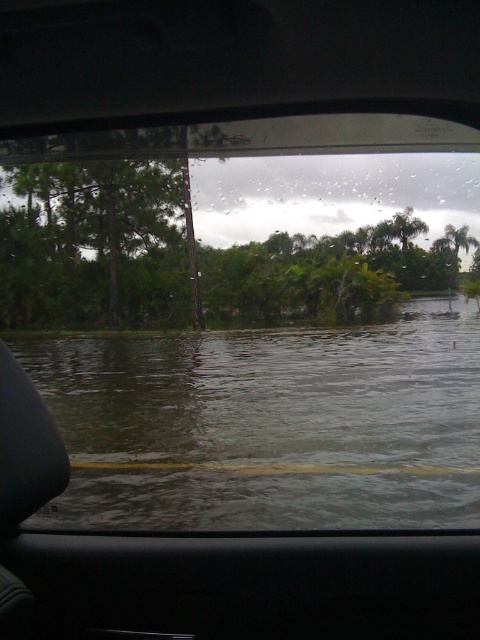
You are driving through a flooded area and notice the clear water at lower center and the green leafy tree at center. Which object is closer to the car windshield?

The clear water at lower center is closer to the car windshield than the green leafy tree at center because it is positioned below it.

You are driving through a flooded area and notice two green leafy trees outside your car window. Based on their sizes, which tree would appear closer to you, the green leafy tree at center or the green leafy tree at left?

The green leafy tree at center appears closer because it has a larger size compared to the green leafy tree at left.

You are driving a car and see the flooded road ahead. You notice the clear water at lower center and the green leafy tree at left. Which object in your view is bigger?

The clear water at lower center has a larger size compared to the green leafy tree at left, so the clear water at lower center is bigger.